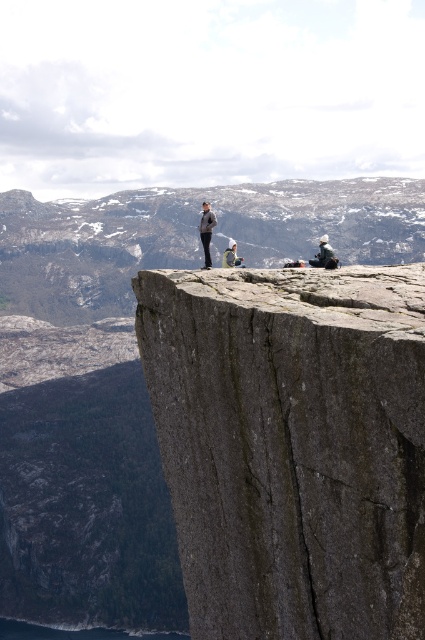
You are a hiker standing on the cliff edge. You see the gray rough rock at center and the gray fabric jacket at center. Which object is wider?

The gray rough rock at center is wider than the gray fabric jacket at center.

You are standing on the cliff edge and want to place a small backpack between the gray rough rock at center and the gray fabric jacket at center. Which object should you place it closer to if you want to avoid the area below the rock?

You should place the backpack closer to the gray fabric jacket at center because the gray rough rock at center is positioned over it, meaning the area below the rock might be unsafe or unstable.